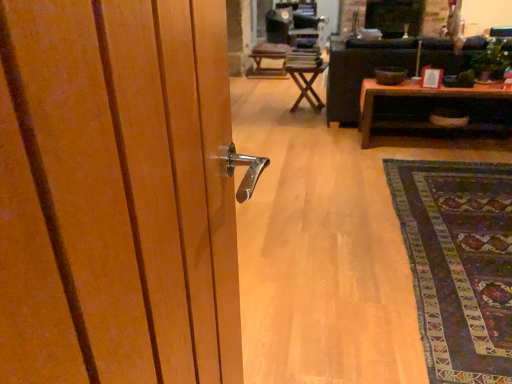
Question: From the image's perspective, is wooden chair at center over wooden table at center, which is the 1th table from back to front?

Choices:
 (A) no
 (B) yes

Answer: (B)

Question: Is wooden chair at center surrounding wooden table at center, arranged as the 2th table when viewed from the right?

Choices:
 (A) yes
 (B) no

Answer: (B)

Question: Can you confirm if wooden chair at center is thinner than wooden table at center, marked as the second table in a front-to-back arrangement?

Choices:
 (A) yes
 (B) no

Answer: (B)

Question: Is wooden chair at center positioned behind wooden table at center, arranged as the 2th table when viewed from the right?

Choices:
 (A) no
 (B) yes

Answer: (B)

Question: Is wooden chair at center wider than wooden table at center, arranged as the 2th table when viewed from the right?

Choices:
 (A) yes
 (B) no

Answer: (A)

Question: From the image's perspective, is wooden table at center, marked as the first table in a left-to-right arrangement, above or below black leather couch at center?

Choices:
 (A) below
 (B) above

Answer: (A)

Question: Is wooden table at center, arranged as the 2th table when viewed from the right, spatially inside black leather couch at center, or outside of it?

Choices:
 (A) inside
 (B) outside

Answer: (B)

Question: Visually, is wooden table at center, marked as the second table in a front-to-back arrangement, positioned to the left or to the right of black leather couch at center?

Choices:
 (A) right
 (B) left

Answer: (B)

Question: Is wooden table at center, arranged as the 2th table when viewed from the right, bigger or smaller than black leather couch at center?

Choices:
 (A) small
 (B) big

Answer: (A)

Question: Which is correct: dark purple woven rug at lower right is inside wooden chair at center, or outside of it?

Choices:
 (A) inside
 (B) outside

Answer: (B)

Question: Is dark purple woven rug at lower right in front of or behind wooden chair at center in the image?

Choices:
 (A) front
 (B) behind

Answer: (A)

Question: In the image, is dark purple woven rug at lower right on the left side or the right side of wooden chair at center?

Choices:
 (A) right
 (B) left

Answer: (A)

Question: Looking at their shapes, would you say dark purple woven rug at lower right is wider or thinner than wooden chair at center?

Choices:
 (A) wide
 (B) thin

Answer: (A)

Question: Is point (304, 87) positioned closer to the camera than point (372, 82)?

Choices:
 (A) farther
 (B) closer

Answer: (A)

Question: Based on their positions, is wooden table at center, arranged as the 2th table when viewed from the right, located to the left or right of brown wooden table at center, marked as the first table in a right-to-left arrangement?

Choices:
 (A) right
 (B) left

Answer: (B)